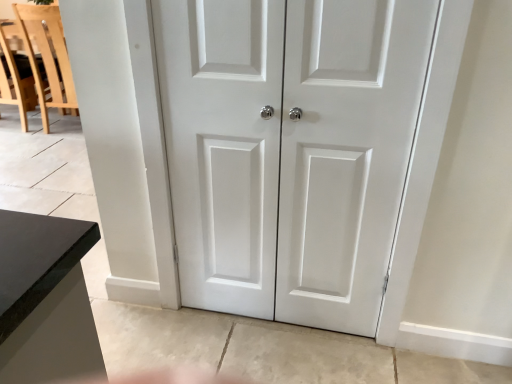
Question: Is the surface of light wood chair at left in direct contact with white matte door at center?

Choices:
 (A) no
 (B) yes

Answer: (A)

Question: Is light wood chair at left outside of white matte door at center?

Choices:
 (A) yes
 (B) no

Answer: (A)

Question: Considering the relative positions of light wood chair at left and white matte door at center in the image provided, is light wood chair at left to the right of white matte door at center from the viewer's perspective?

Choices:
 (A) yes
 (B) no

Answer: (B)

Question: Can you confirm if light wood chair at left is bigger than white matte door at center?

Choices:
 (A) no
 (B) yes

Answer: (B)

Question: From the image's perspective, is light wood chair at left below white matte door at center?

Choices:
 (A) no
 (B) yes

Answer: (A)

Question: Relative to light wood chair at left, is white matte door at center in front or behind?

Choices:
 (A) front
 (B) behind

Answer: (A)

Question: Is white matte door at center wider or thinner than light wood chair at left?

Choices:
 (A) wide
 (B) thin

Answer: (B)

Question: Is white matte door at center inside the boundaries of light wood chair at left, or outside?

Choices:
 (A) outside
 (B) inside

Answer: (A)

Question: Based on their sizes in the image, would you say white matte door at center is bigger or smaller than light wood chair at left?

Choices:
 (A) big
 (B) small

Answer: (B)

Question: Is white matte door at center wider or thinner than light wood chair at left?

Choices:
 (A) thin
 (B) wide

Answer: (A)

Question: Do you think white matte door at center is within light wood chair at left, or outside of it?

Choices:
 (A) outside
 (B) inside

Answer: (A)

Question: Looking at the image, does white matte door at center seem bigger or smaller compared to light wood chair at left?

Choices:
 (A) small
 (B) big

Answer: (A)

Question: Does point 167,1 appear closer or farther from the camera than point 74,109?

Choices:
 (A) closer
 (B) farther

Answer: (A)

Question: From a real-world perspective, relative to white matte door at center, is light wood chair at left vertically above or below?

Choices:
 (A) above
 (B) below

Answer: (B)

Question: In the image, is light wood chair at left on the left side or the right side of white matte door at center?

Choices:
 (A) left
 (B) right

Answer: (A)